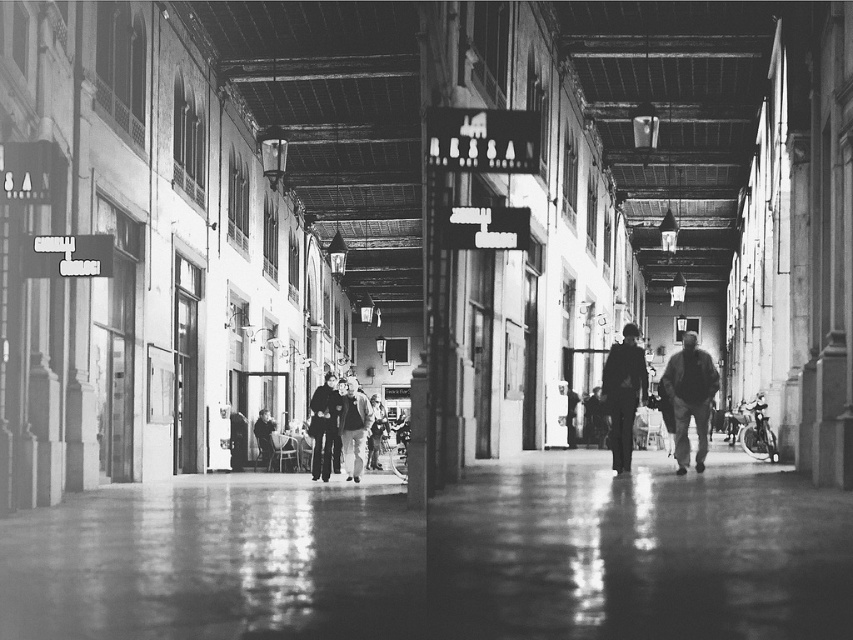
You are standing at the entrance of the market and want to find the smooth leather jacket at center. According to the coordinates provided, in which direction should you look to locate it?

The smooth leather jacket at center is located at coordinates point [689,397], which means it is positioned to the right and slightly below the center of the scene. You should look towards the lower right area from the entrance to find it.

You are a customer in the market and want to pick up the smooth leather jacket at center and the dark blue jeans at center. Which item is easier to reach without moving your current position?

The smooth leather jacket at center is closer to the viewer than the dark blue jeans at center, so it is easier to reach without moving.